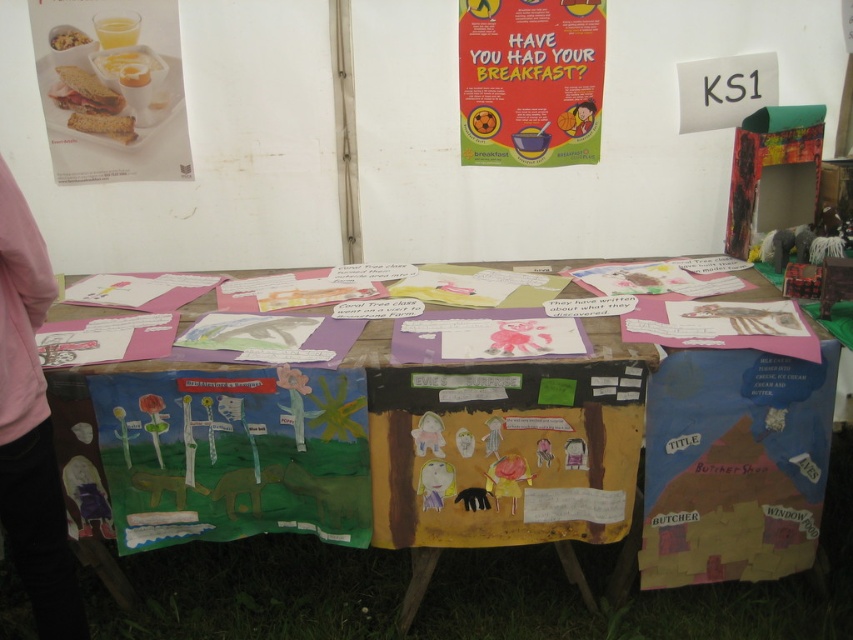
You are at an outdoor event and see the wooden table at center and the red paper poster at upper center. Which object is positioned to the right of the other?

Answer: The wooden table at center is to the right of the red paper poster at upper center.

You are a visitor at the event and want to place a small gift on the wooden table at center. The gift is exactly the same height as the matte plastic food at upper left. Will the gift fit on the table without being taller than the table itself?

The wooden table at center has a greater height compared to the matte plastic food at upper left. Since the gift is the same height as the matte plastic food at upper left, it will not exceed the table height. Therefore, the gift will fit on the wooden table at center without being taller than it.